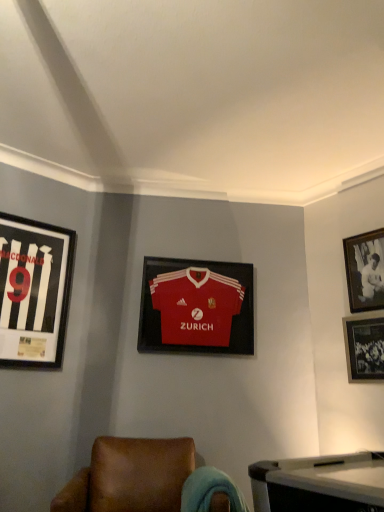
Find the location of a particular element. The width and height of the screenshot is (384, 512). black glossy photo frame at upper right, placed as the first picture frame when sorted from right to left is located at coordinates (365, 270).

What do you see at coordinates (364, 346) in the screenshot?
I see `black glossy photo frame at lower right, the 2th picture frame in the right-to-left sequence` at bounding box center [364, 346].

The height and width of the screenshot is (512, 384). What do you see at coordinates (34, 292) in the screenshot? I see `black matte jersey at left, arranged as the 1th picture frame when viewed from the left` at bounding box center [34, 292].

What is the approximate width of matte red jersey at center, which is the second picture frame in left-to-right order?

It is 2.53 inches.

You are a GUI agent. You are given a task and a screenshot of the screen. Output one action in this format:
    pyautogui.click(x=<x>, y=<y>)
    Task: Click on the black glossy photo frame at upper right, the 4th picture frame from the left
    The width and height of the screenshot is (384, 512).
    Given the screenshot: What is the action you would take?
    pyautogui.click(x=365, y=270)

Can you tell me how much black glossy photo frame at lower right, which appears as the 3th picture frame when viewed from the left, and black matte jersey at left, acting as the fourth picture frame starting from the right, differ in facing direction?

90.4 degrees.

Who is smaller, black glossy photo frame at lower right, which appears as the 3th picture frame when viewed from the left, or black matte jersey at left, arranged as the 1th picture frame when viewed from the left?

With smaller size is black glossy photo frame at lower right, which appears as the 3th picture frame when viewed from the left.

Is black matte jersey at left, arranged as the 1th picture frame when viewed from the left, completely or partially inside black glossy photo frame at lower right, the 2th picture frame in the right-to-left sequence?

No, black matte jersey at left, arranged as the 1th picture frame when viewed from the left, is located outside of black glossy photo frame at lower right, the 2th picture frame in the right-to-left sequence.

Considering the relative positions of black glossy photo frame at lower right, the 2th picture frame in the right-to-left sequence, and black matte jersey at left, arranged as the 1th picture frame when viewed from the left, in the image provided, is black glossy photo frame at lower right, the 2th picture frame in the right-to-left sequence, in front of black matte jersey at left, arranged as the 1th picture frame when viewed from the left,?

No, the depth of black glossy photo frame at lower right, the 2th picture frame in the right-to-left sequence, is greater than that of black matte jersey at left, arranged as the 1th picture frame when viewed from the left.

Looking at this image, how far apart are black matte jersey at left, acting as the fourth picture frame starting from the right, and black glossy photo frame at upper right, the 4th picture frame from the left?

black matte jersey at left, acting as the fourth picture frame starting from the right, is 6.90 feet away from black glossy photo frame at upper right, the 4th picture frame from the left.

Is black matte jersey at left, arranged as the 1th picture frame when viewed from the left, thinner than black glossy photo frame at upper right, the 4th picture frame from the left?

No, black matte jersey at left, arranged as the 1th picture frame when viewed from the left, is not thinner than black glossy photo frame at upper right, the 4th picture frame from the left.

Looking at the image, does black matte jersey at left, acting as the fourth picture frame starting from the right, seem bigger or smaller compared to black glossy photo frame at upper right, the 4th picture frame from the left?

Considering their sizes, black matte jersey at left, acting as the fourth picture frame starting from the right, takes up more space than black glossy photo frame at upper right, the 4th picture frame from the left.

Is matte red jersey at center, which is the second picture frame in left-to-right order, next to black glossy photo frame at upper right, placed as the first picture frame when sorted from right to left, and touching it?

matte red jersey at center, which is the second picture frame in left-to-right order, and black glossy photo frame at upper right, placed as the first picture frame when sorted from right to left, are not in contact.

Visually, is matte red jersey at center, which is the second picture frame in left-to-right order, positioned to the left or to the right of black glossy photo frame at upper right, placed as the first picture frame when sorted from right to left?

From the image, it's evident that matte red jersey at center, which is the second picture frame in left-to-right order, is to the left of black glossy photo frame at upper right, placed as the first picture frame when sorted from right to left.

In terms of size, does matte red jersey at center, acting as the third picture frame starting from the right, appear bigger or smaller than black glossy photo frame at upper right, placed as the first picture frame when sorted from right to left?

Clearly, matte red jersey at center, acting as the third picture frame starting from the right, is larger in size than black glossy photo frame at upper right, placed as the first picture frame when sorted from right to left.

Is black matte jersey at left, arranged as the 1th picture frame when viewed from the left, oriented away from matte red jersey at center, which is the second picture frame in left-to-right order?

No, matte red jersey at center, which is the second picture frame in left-to-right order, is not at the back of black matte jersey at left, arranged as the 1th picture frame when viewed from the left.

From the image's perspective, is black matte jersey at left, arranged as the 1th picture frame when viewed from the left, positioned above or below matte red jersey at center, acting as the third picture frame starting from the right?

Clearly, from the image's perspective, black matte jersey at left, arranged as the 1th picture frame when viewed from the left, is above matte red jersey at center, acting as the third picture frame starting from the right.

Which of these two, black matte jersey at left, arranged as the 1th picture frame when viewed from the left, or matte red jersey at center, acting as the third picture frame starting from the right, is thinner?

Thinner between the two is matte red jersey at center, acting as the third picture frame starting from the right.

Does black matte jersey at left, acting as the fourth picture frame starting from the right, come in front of matte red jersey at center, acting as the third picture frame starting from the right?

Yes, black matte jersey at left, acting as the fourth picture frame starting from the right, is closer to the camera.

Consider the image. Is black glossy photo frame at upper right, placed as the first picture frame when sorted from right to left, positioned with its back to matte red jersey at center, which is the second picture frame in left-to-right order?

black glossy photo frame at upper right, placed as the first picture frame when sorted from right to left, does not have its back to matte red jersey at center, which is the second picture frame in left-to-right order.

Is matte red jersey at center, which is the second picture frame in left-to-right order, inside black glossy photo frame at upper right, placed as the first picture frame when sorted from right to left?

No.

Is black glossy photo frame at upper right, placed as the first picture frame when sorted from right to left, to the left or to the right of matte red jersey at center, acting as the third picture frame starting from the right, in the image?

black glossy photo frame at upper right, placed as the first picture frame when sorted from right to left, is to the right of matte red jersey at center, acting as the third picture frame starting from the right.

Can you tell me how much matte red jersey at center, acting as the third picture frame starting from the right, and black glossy photo frame at lower right, the 2th picture frame in the right-to-left sequence, differ in facing direction?

57.7 degrees.

Is point (188, 263) closer or farther from the camera than point (377, 370)?

Point (188, 263) is positioned farther from the camera compared to point (377, 370).

Looking at this image, from a real-world perspective, who is located higher, matte red jersey at center, which is the second picture frame in left-to-right order, or black glossy photo frame at lower right, which appears as the 3th picture frame when viewed from the left?

From a 3D spatial view, matte red jersey at center, which is the second picture frame in left-to-right order, is above.

Considering the relative sizes of matte red jersey at center, acting as the third picture frame starting from the right, and black glossy photo frame at lower right, the 2th picture frame in the right-to-left sequence, in the image provided, is matte red jersey at center, acting as the third picture frame starting from the right, smaller than black glossy photo frame at lower right, the 2th picture frame in the right-to-left sequence,?

No.

Considering the points (63, 500) and (199, 321), which point is behind, point (63, 500) or point (199, 321)?

Positioned behind is point (199, 321).

Is there a large distance between brown leather chair at lower center and matte red jersey at center, acting as the third picture frame starting from the right?

That's not correct — brown leather chair at lower center is a little close to matte red jersey at center, acting as the third picture frame starting from the right.

From the image's perspective, which object appears higher, brown leather chair at lower center or matte red jersey at center, which is the second picture frame in left-to-right order?

matte red jersey at center, which is the second picture frame in left-to-right order.

Can you confirm if brown leather chair at lower center is wider than matte red jersey at center, acting as the third picture frame starting from the right?

Yes.

Where is `picture frame that is the 2nd object to the right of the black matte jersey at left, arranged as the 1th picture frame when viewed from the left, starting at the anchor`? The height and width of the screenshot is (512, 384). picture frame that is the 2nd object to the right of the black matte jersey at left, arranged as the 1th picture frame when viewed from the left, starting at the anchor is located at coordinates (364, 346).

I want to click on the 1st picture frame located beneath the black glossy photo frame at upper right, placed as the first picture frame when sorted from right to left (from a real-world perspective), so click(x=34, y=292).

Based on their spatial positions, is black glossy photo frame at lower right, which appears as the 3th picture frame when viewed from the left, or matte red jersey at center, which is the second picture frame in left-to-right order, further from brown leather chair at lower center?

Based on the image, black glossy photo frame at lower right, which appears as the 3th picture frame when viewed from the left, appears to be further to brown leather chair at lower center.

When comparing their distances from black matte jersey at left, arranged as the 1th picture frame when viewed from the left, does matte red jersey at center, acting as the third picture frame starting from the right, or black glossy photo frame at upper right, placed as the first picture frame when sorted from right to left, seem further?

black glossy photo frame at upper right, placed as the first picture frame when sorted from right to left.

Looking at the image, which one is located further to black glossy photo frame at lower right, the 2th picture frame in the right-to-left sequence, matte red jersey at center, which is the second picture frame in left-to-right order, or brown leather chair at lower center?

The object further to black glossy photo frame at lower right, the 2th picture frame in the right-to-left sequence, is brown leather chair at lower center.

When comparing their distances from black matte jersey at left, arranged as the 1th picture frame when viewed from the left, does black glossy photo frame at upper right, placed as the first picture frame when sorted from right to left, or black glossy photo frame at lower right, the 2th picture frame in the right-to-left sequence, seem further?

black glossy photo frame at upper right, placed as the first picture frame when sorted from right to left, lies further to black matte jersey at left, arranged as the 1th picture frame when viewed from the left, than the other object.

Looking at the image, which one is located closer to black glossy photo frame at upper right, the 4th picture frame from the left, black matte jersey at left, arranged as the 1th picture frame when viewed from the left, or matte red jersey at center, which is the second picture frame in left-to-right order?

Based on the image, matte red jersey at center, which is the second picture frame in left-to-right order, appears to be nearer to black glossy photo frame at upper right, the 4th picture frame from the left.

When comparing their distances from black matte jersey at left, arranged as the 1th picture frame when viewed from the left, does black glossy photo frame at lower right, the 2th picture frame in the right-to-left sequence, or matte red jersey at center, acting as the third picture frame starting from the right, seem closer?

The object closer to black matte jersey at left, arranged as the 1th picture frame when viewed from the left, is matte red jersey at center, acting as the third picture frame starting from the right.

Based on their spatial positions, is brown leather chair at lower center or matte red jersey at center, acting as the third picture frame starting from the right, further from black glossy photo frame at lower right, which appears as the 3th picture frame when viewed from the left?

brown leather chair at lower center.

When comparing their distances from black glossy photo frame at lower right, the 2th picture frame in the right-to-left sequence, does black matte jersey at left, acting as the fourth picture frame starting from the right, or matte red jersey at center, which is the second picture frame in left-to-right order, seem closer?

matte red jersey at center, which is the second picture frame in left-to-right order, lies closer to black glossy photo frame at lower right, the 2th picture frame in the right-to-left sequence, than the other object.

This screenshot has height=512, width=384. I want to click on picture frame situated between brown leather chair at lower center and black glossy photo frame at lower right, which appears as the 3th picture frame when viewed from the left, from left to right, so click(196, 307).

Find the location of a particular element. picture frame located between matte red jersey at center, which is the second picture frame in left-to-right order, and black glossy photo frame at upper right, the 4th picture frame from the left, in the left-right direction is located at coordinates [364, 346].

Identify the location of picture frame between black matte jersey at left, arranged as the 1th picture frame when viewed from the left, and black glossy photo frame at lower right, which appears as the 3th picture frame when viewed from the left. This screenshot has width=384, height=512. (196, 307).

You are a GUI agent. You are given a task and a screenshot of the screen. Output one action in this format:
    pyautogui.click(x=<x>, y=<y>)
    Task: Click on the chair between black matte jersey at left, arranged as the 1th picture frame when viewed from the left, and black glossy photo frame at lower right, which appears as the 3th picture frame when viewed from the left
    The width and height of the screenshot is (384, 512).
    Given the screenshot: What is the action you would take?
    pyautogui.click(x=130, y=476)